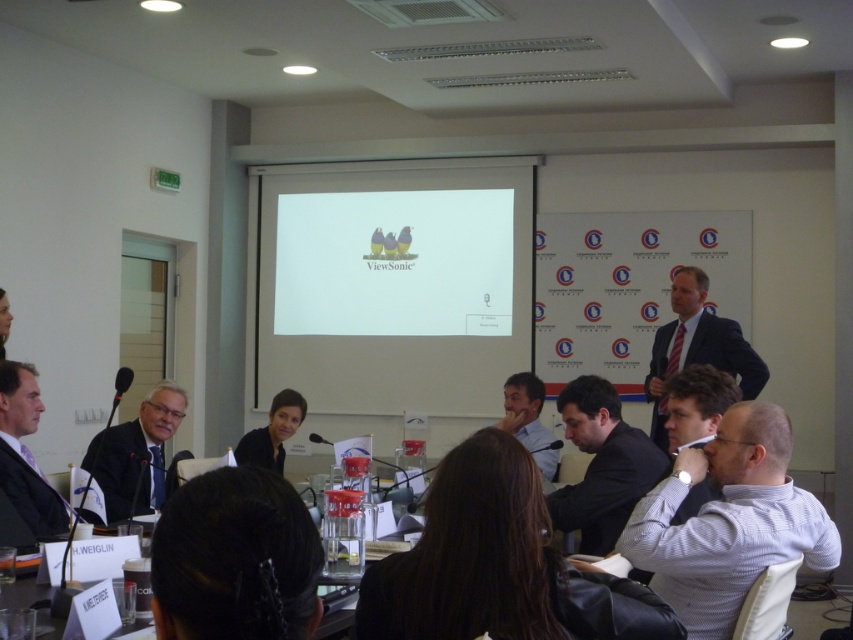
You are standing in the room and want to find the dark suit at left. Where should you look?

You should look at point (25,452) to find the dark suit at left.

You are standing at the entrance of the room and want to locate the matte black suit at left. Based on the coordinates provided, in which direction should you look relative to your position?

The matte black suit at left is located at coordinates point (136, 452), so you should look towards the right side of the room since the x coordinate is 0.709 which is greater than 0.5, indicating it is on the right half of the room.

You are organizing a charity event and need to seat guests based on their attire. If you have two guests wearing a dark suit at left and a black fabric shirt at center, which guest should you seat first to accommodate their clothing size?

The dark suit at left should be seated first because it is larger in size than the black fabric shirt at center, so they may require more space.